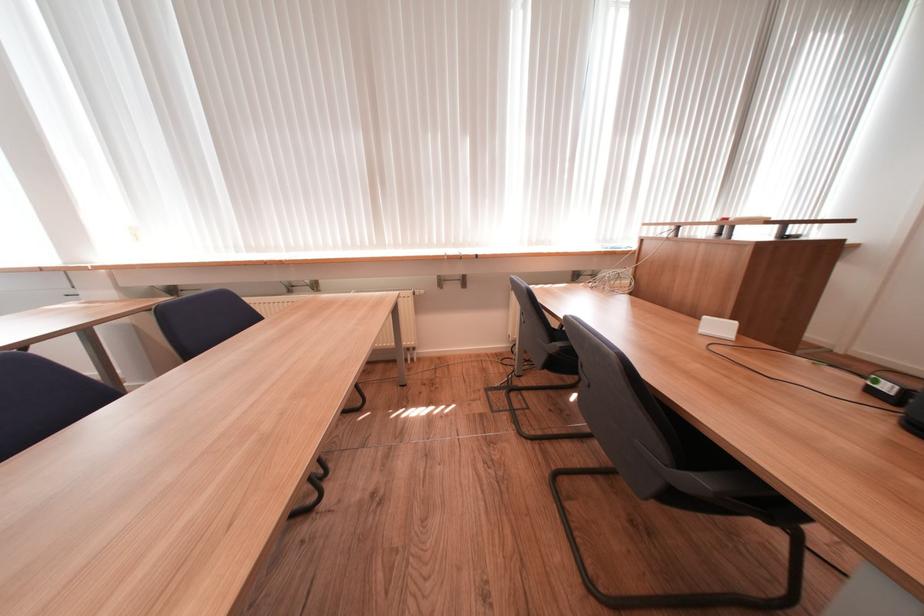
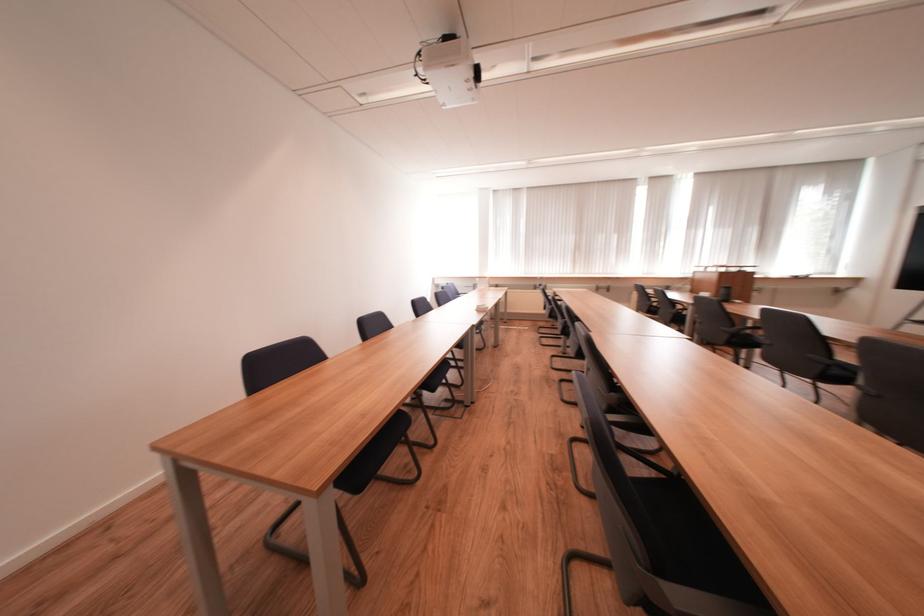
Question: The images are taken continuously from a first-person perspective. In which direction are you moving?

Choices:
 (A) Left
 (B) Right
 (C) Forward
 (D) Backward

Answer: (D)